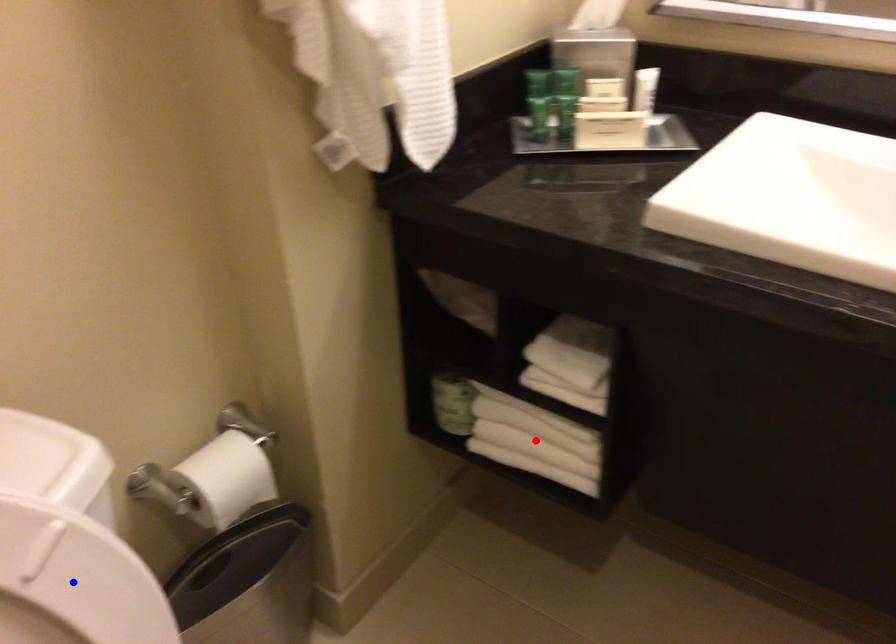
Question: Two points are marked on the image. Which point is closer to the camera?

Choices:
 (A) Blue point is closer.
 (B) Red point is closer.

Answer: (A)